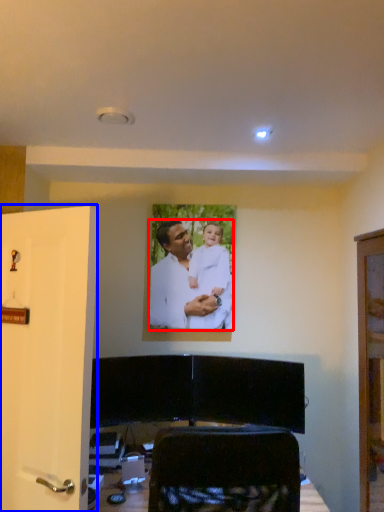
Question: Which of the following is the farthest to the observer, man (highlighted by a red box) or door (highlighted by a blue box)?

Choices:
 (A) man
 (B) door

Answer: (A)